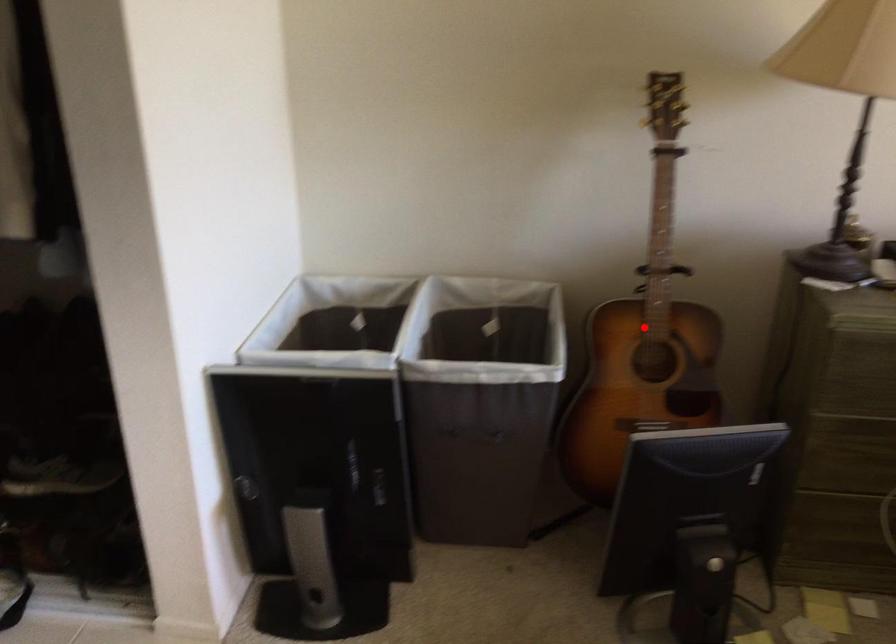
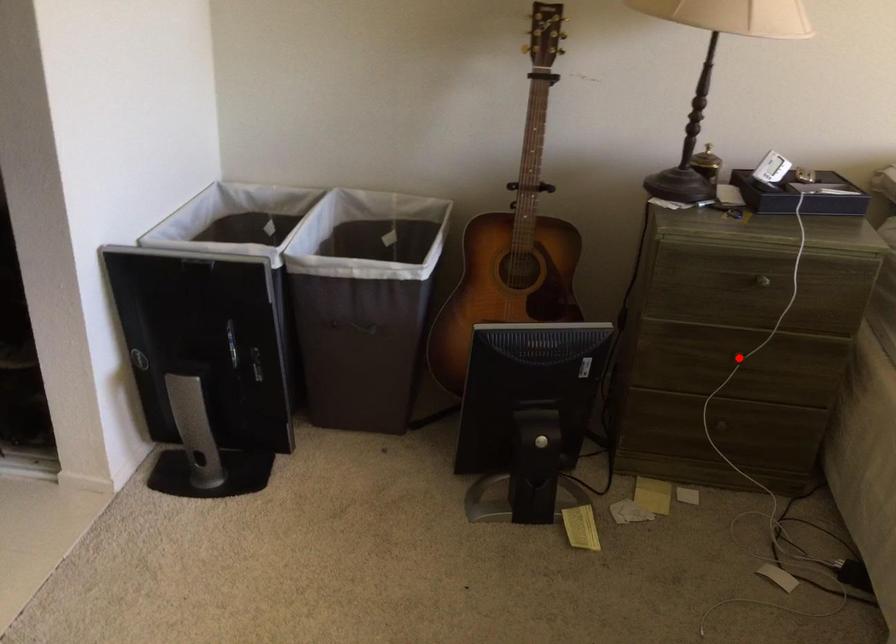
I am providing you with two images of the same scene from different viewpoints. A red point is marked on the first image and another point is marked on the second image. Are the points marked in image1 and image2 representing the same 3D position?

No